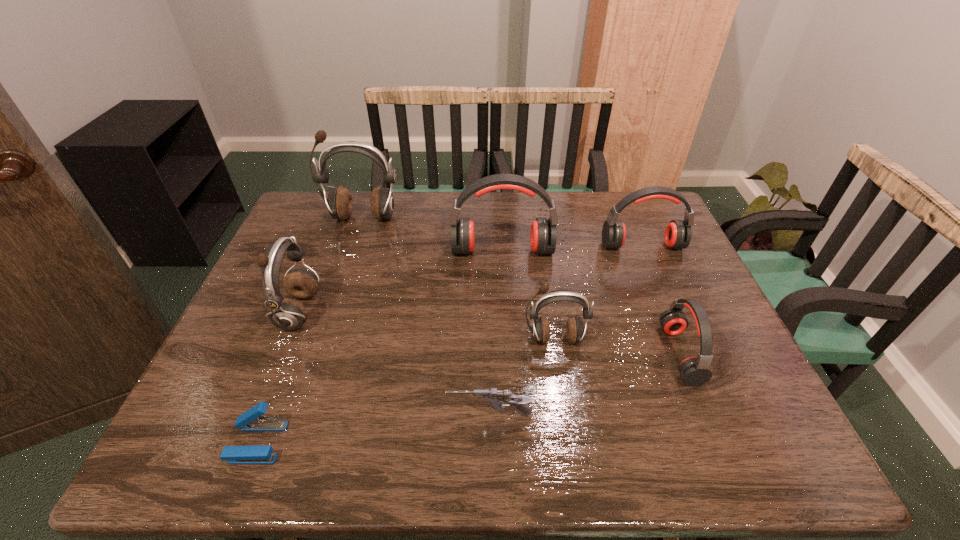
At what (x,y) coordinates should I click in order to perform the action: click on red earphone that can be found as the second closest to the shortest earphone. Please return your answer as a coordinate pair (x, y). The width and height of the screenshot is (960, 540). Looking at the image, I should click on (543, 235).

Locate an element on the screen. The height and width of the screenshot is (540, 960). vacant space that satisfies the following two spatial constraints: 1. on the ear pads of the second smallest brown earphone; 2. on the back side of the nearest object is located at coordinates (247, 442).

At what (x,y) coordinates should I click in order to perform the action: click on free location that satisfies the following two spatial constraints: 1. on the ear pads of the rightmost brown earphone; 2. at the barrel of the seventh farthest object. Please return your answer as a coordinate pair (x, y). Image resolution: width=960 pixels, height=540 pixels. Looking at the image, I should click on (566, 415).

The image size is (960, 540). Find the location of `free space that satisfies the following two spatial constraints: 1. on the ear pads of the biggest brown earphone; 2. on the ear pads of the second smallest brown earphone`. free space that satisfies the following two spatial constraints: 1. on the ear pads of the biggest brown earphone; 2. on the ear pads of the second smallest brown earphone is located at coordinates (330, 313).